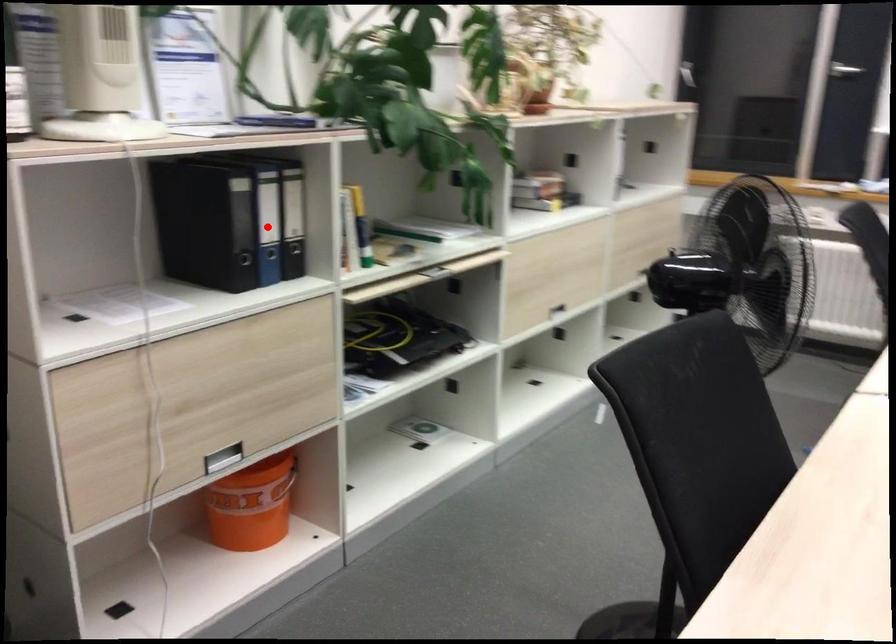
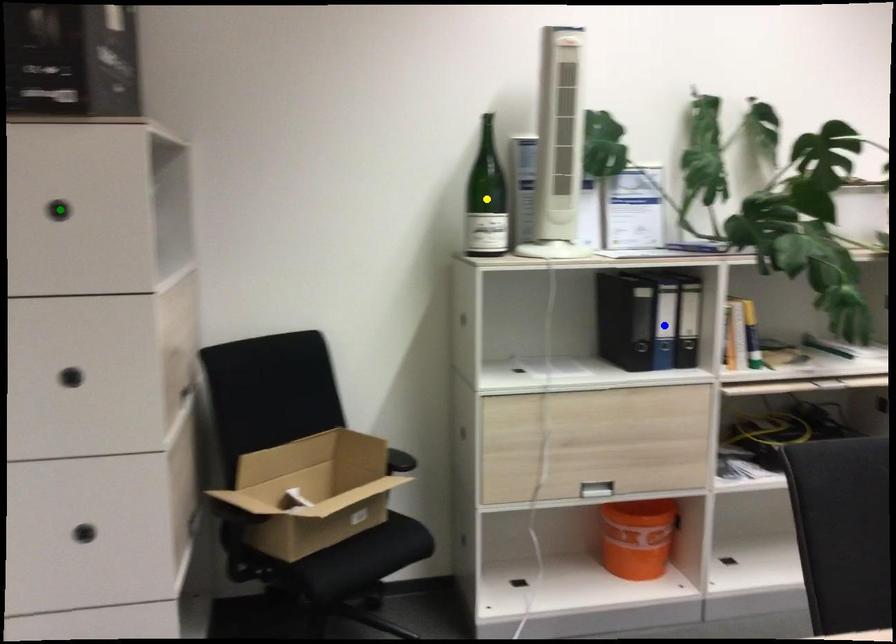
Question: I am providing you with two images of the same scene from different viewpoints. A red point is marked on the first image. You are given multiple points on the second image. Can you choose the point in image 2 that corresponds to the point in image 1?

Choices:
 (A) green point
 (B) yellow point
 (C) blue point

Answer: (C)